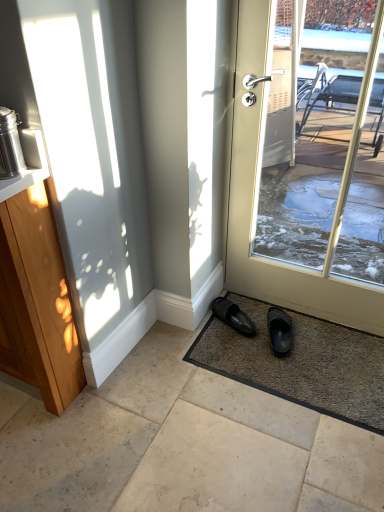
Identify the location of vacant space underneath brown textured mat at lower center (from a real-world perspective). This screenshot has height=512, width=384. (304, 365).